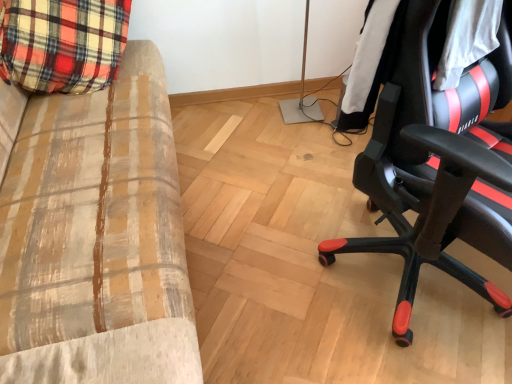
Question: Does plaid fabric couch at left have a greater width compared to black leather chair at right?

Choices:
 (A) yes
 (B) no

Answer: (A)

Question: Does plaid fabric couch at left have a greater height compared to black leather chair at right?

Choices:
 (A) no
 (B) yes

Answer: (A)

Question: From a real-world perspective, is plaid fabric couch at left beneath black leather chair at right?

Choices:
 (A) no
 (B) yes

Answer: (B)

Question: Is plaid fabric couch at left turned away from black leather chair at right?

Choices:
 (A) no
 (B) yes

Answer: (A)

Question: Does plaid fabric couch at left have a smaller size compared to black leather chair at right?

Choices:
 (A) yes
 (B) no

Answer: (B)

Question: In terms of width, does plaid fabric couch at left look wider or thinner when compared to black leather jacket at right?

Choices:
 (A) wide
 (B) thin

Answer: (A)

Question: Do you think plaid fabric couch at left is within black leather jacket at right, or outside of it?

Choices:
 (A) inside
 (B) outside

Answer: (B)

Question: Considering the relative positions of plaid fabric couch at left and black leather jacket at right in the image provided, is plaid fabric couch at left to the left or to the right of black leather jacket at right?

Choices:
 (A) left
 (B) right

Answer: (A)

Question: Is plaid fabric couch at left in front of or behind black leather jacket at right in the image?

Choices:
 (A) front
 (B) behind

Answer: (A)

Question: Choose the correct answer: Is black leather chair at right inside black leather jacket at right or outside it?

Choices:
 (A) outside
 (B) inside

Answer: (A)

Question: Considering the positions of black leather chair at right and black leather jacket at right in the image, is black leather chair at right wider or thinner than black leather jacket at right?

Choices:
 (A) thin
 (B) wide

Answer: (B)

Question: From the image's perspective, is black leather chair at right above or below black leather jacket at right?

Choices:
 (A) above
 (B) below

Answer: (B)

Question: Based on their sizes in the image, would you say black leather chair at right is bigger or smaller than black leather jacket at right?

Choices:
 (A) small
 (B) big

Answer: (B)

Question: In the image, is black leather jacket at right positioned in front of or behind black leather chair at right?

Choices:
 (A) behind
 (B) front

Answer: (A)

Question: From a real-world perspective, relative to black leather chair at right, is black leather jacket at right vertically above or below?

Choices:
 (A) above
 (B) below

Answer: (A)